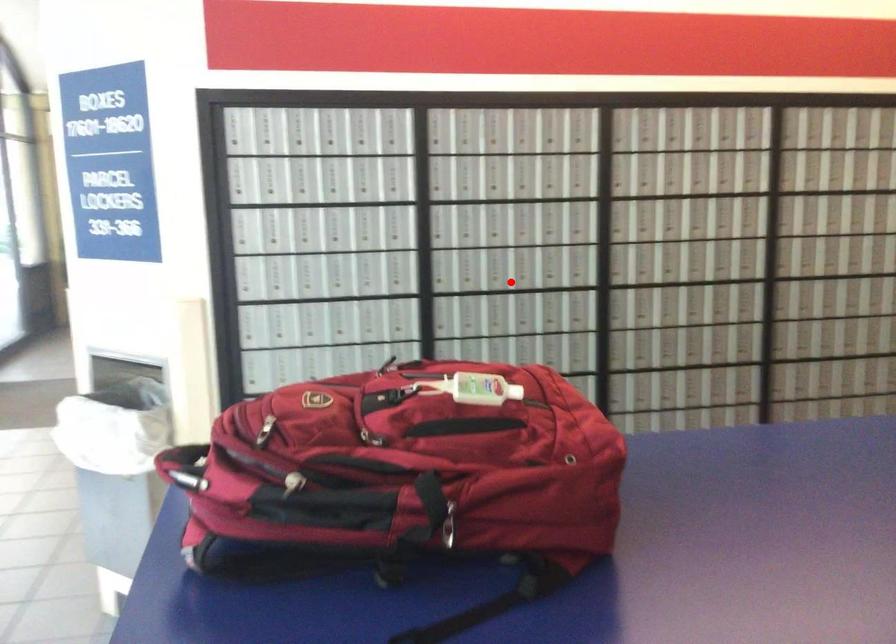
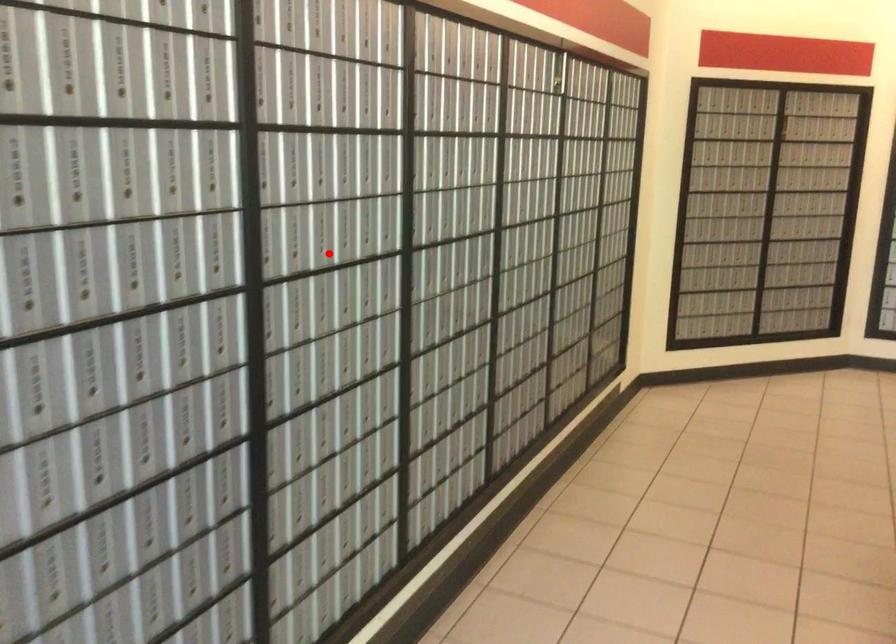
I am providing you with two images of the same scene from different viewpoints. A red point is marked on the first image and another point is marked on the second image. Do the highlighted points in image1 and image2 indicate the same real-world spot?

Yes